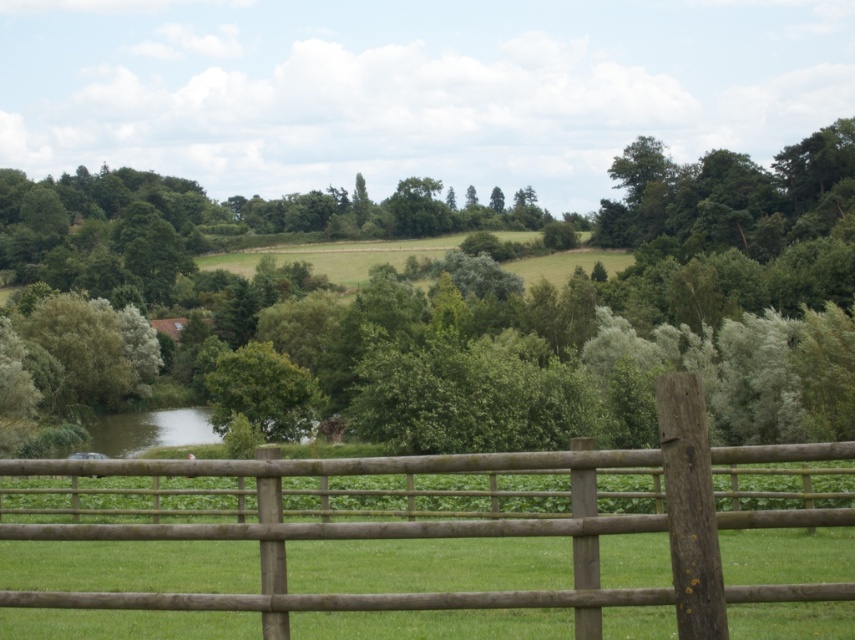
You are a painter standing at the edge of the brown wooden fence at center, wanting to paint the green leafy tree at center. Since you can only paint objects within 10 meters of you, can you reach the tree with your brush?

The brown wooden fence at center is less wide than the green leafy tree at center. However, the description does not provide the actual distance between them, so it is impossible to determine if the tree is within 10 meters.

You are standing at the point marked by the coordinates point (260, 390). Looking around, you see a wooden fence in the foreground and a calm body of water beyond a green field. Which direction should you walk to reach the wooden fence?

Since the wooden fence is in the foreground and you are at the point marked by point (260, 390), which is the green leafy tree at center, you should walk backward or towards the direction opposite to the calm body of water to reach the wooden fence.